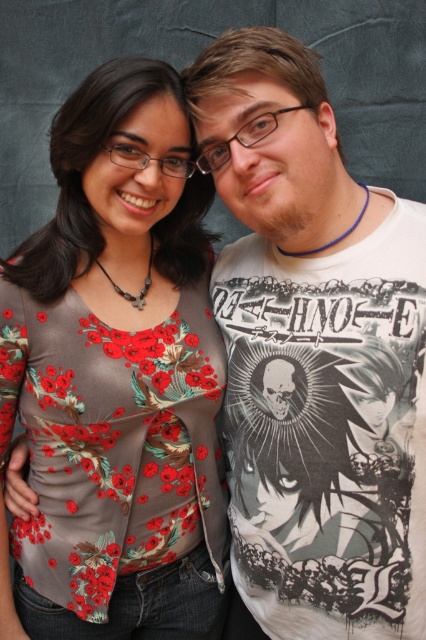
Question: Which point appears closest to the camera in this image?

Choices:
 (A) (123, 525)
 (B) (299, 316)

Answer: (B)

Question: Does white printed t-shirt at center have a larger size compared to floral-patterned fabric shirt at center?

Choices:
 (A) no
 (B) yes

Answer: (A)

Question: Which point appears closest to the camera in this image?

Choices:
 (A) (386, 394)
 (B) (164, 320)

Answer: (A)

Question: Among these objects, which one is nearest to the camera?

Choices:
 (A) floral-patterned fabric shirt at center
 (B) white printed t-shirt at center

Answer: (B)

Question: Can you confirm if white printed t-shirt at center is wider than floral-patterned fabric shirt at center?

Choices:
 (A) yes
 (B) no

Answer: (B)

Question: Can you confirm if white printed t-shirt at center is positioned below floral-patterned fabric shirt at center?

Choices:
 (A) no
 (B) yes

Answer: (A)